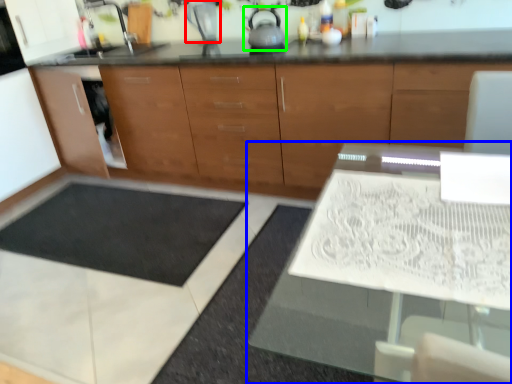
Question: Considering the real-world distances, which object is closest to appliance (highlighted by a red box)? table (highlighted by a blue box) or tea pot (highlighted by a green box).

Choices:
 (A) table
 (B) tea pot

Answer: (B)